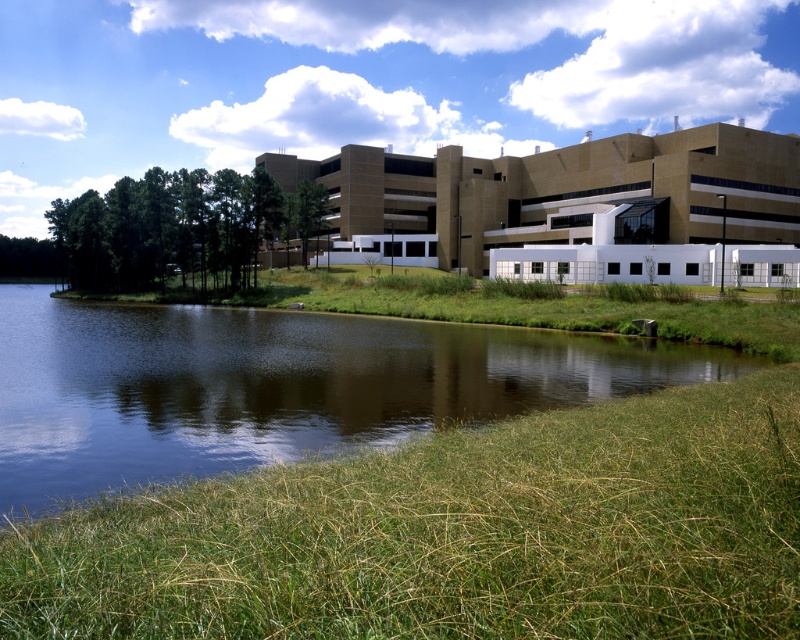
Question: Which of the following is the farthest from the observer?

Choices:
 (A) (590, 570)
 (B) (90, 480)

Answer: (B)

Question: Among these points, which one is nearest to the camera?

Choices:
 (A) (732, 572)
 (B) (344, 432)

Answer: (A)

Question: Can you confirm if green grass at lower center is positioned to the right of green grassy river at lower left?

Choices:
 (A) no
 (B) yes

Answer: (B)

Question: Among these objects, which one is farthest from the camera?

Choices:
 (A) green grassy river at lower left
 (B) green grass at lower center

Answer: (A)

Question: Can you confirm if green grass at lower center is positioned to the left of green grassy river at lower left?

Choices:
 (A) yes
 (B) no

Answer: (B)

Question: Is green grass at lower center above green grassy river at lower left?

Choices:
 (A) no
 (B) yes

Answer: (A)